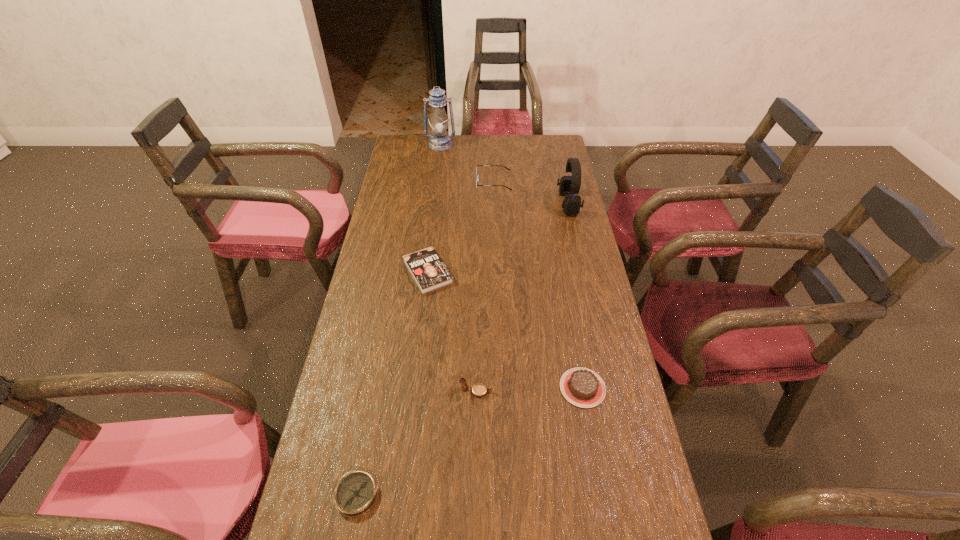
The image size is (960, 540). I want to click on free space located on the left of the fourth nearest object, so click(x=383, y=272).

You are a GUI agent. You are given a task and a screenshot of the screen. Output one action in this format:
    pyautogui.click(x=<x>, y=<y>)
    Task: Click on the free space located 0.170m on the back of the left compass
    Image resolution: width=960 pixels, height=540 pixels.
    Given the screenshot: What is the action you would take?
    pyautogui.click(x=373, y=402)

Identify the location of object located in the far edge section of the desktop. (439, 141).

At what (x,y) coordinates should I click in order to perform the action: click on lantern located in the left edge section of the desktop. Please return your answer as a coordinate pair (x, y). Looking at the image, I should click on (439, 141).

In order to click on book that is at the left edge in this screenshot , I will do `click(428, 270)`.

What are the coordinates of `compass located in the left edge section of the desktop` in the screenshot? It's located at (356, 492).

Find the location of a particular element. This screenshot has height=540, width=960. headset located at the right edge is located at coordinates pyautogui.click(x=569, y=185).

Find the location of `chocolate cake that is at the right edge`. chocolate cake that is at the right edge is located at coordinates (582, 387).

Find the location of `object that is at the far left corner`. object that is at the far left corner is located at coordinates (439, 141).

Where is `vacant space at the far edge`? vacant space at the far edge is located at coordinates (469, 160).